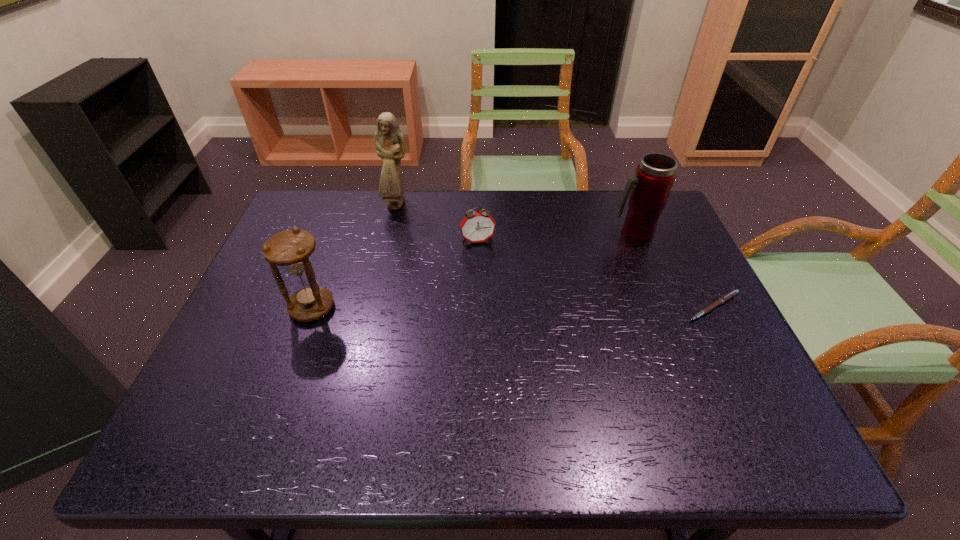
This screenshot has width=960, height=540. In the image, there is a desktop. Identify the location of free space at the near right corner. (700, 390).

The height and width of the screenshot is (540, 960). Identify the location of unoccupied area between the leftmost object and the pen. (513, 307).

Where is `free space between the thermos bottle and the shortest object`? Image resolution: width=960 pixels, height=540 pixels. free space between the thermos bottle and the shortest object is located at coordinates [x=673, y=270].

Locate an element on the screen. The height and width of the screenshot is (540, 960). free spot between the third object from right to left and the leftmost object is located at coordinates (396, 274).

Find the location of `vacant point located between the thermos bottle and the pen`. vacant point located between the thermos bottle and the pen is located at coordinates (673, 270).

What are the coordinates of `free space between the hourglass and the farthest object` in the screenshot? It's located at (355, 256).

Locate an element on the screen. Image resolution: width=960 pixels, height=540 pixels. vacant space that is in between the fourth object from right to left and the shortest object is located at coordinates (556, 255).

You are a GUI agent. You are given a task and a screenshot of the screen. Output one action in this format:
    pyautogui.click(x=<x>, y=<y>)
    Task: Click on the vacant point located between the alarm clock and the leftmost object
    The image size is (960, 540).
    Given the screenshot: What is the action you would take?
    pyautogui.click(x=396, y=274)

Where is `vacant space that is in between the alarm clock and the hourglass`? vacant space that is in between the alarm clock and the hourglass is located at coordinates [x=396, y=274].

Locate an element on the screen. The height and width of the screenshot is (540, 960). free space between the hourglass and the pen is located at coordinates (513, 307).